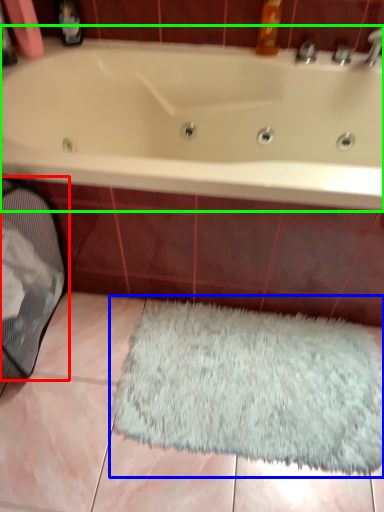
Question: Based on their relative distances, which object is farther from laundry basket (highlighted by a red box)? Choose from doormat (highlighted by a blue box) and bathtub (highlighted by a green box).

Choices:
 (A) doormat
 (B) bathtub

Answer: (A)